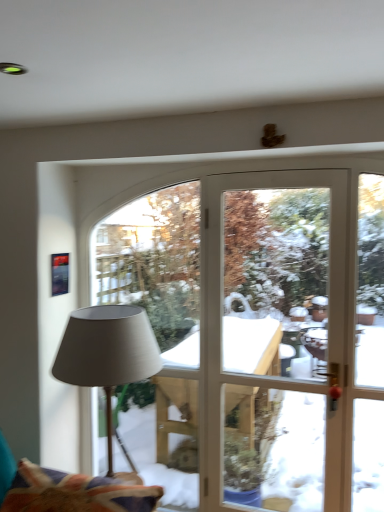
Question: From the image's perspective, is matte gray fabric lamp at left positioned above or below velvet fabric swivel chair at lower left?

Choices:
 (A) below
 (B) above

Answer: (B)

Question: In terms of height, does matte gray fabric lamp at left look taller or shorter compared to velvet fabric swivel chair at lower left?

Choices:
 (A) tall
 (B) short

Answer: (A)

Question: Would you say matte gray fabric lamp at left is to the left or to the right of velvet fabric swivel chair at lower left in the picture?

Choices:
 (A) left
 (B) right

Answer: (B)

Question: From a real-world perspective, relative to matte gray fabric lamp at left, is velvet fabric swivel chair at lower left vertically above or below?

Choices:
 (A) above
 (B) below

Answer: (B)

Question: Is velvet fabric swivel chair at lower left spatially inside matte gray fabric lamp at left, or outside of it?

Choices:
 (A) outside
 (B) inside

Answer: (A)

Question: Relative to matte gray fabric lamp at left, is velvet fabric swivel chair at lower left in front or behind?

Choices:
 (A) front
 (B) behind

Answer: (A)

Question: Visually, is velvet fabric swivel chair at lower left positioned to the left or to the right of matte gray fabric lamp at left?

Choices:
 (A) right
 (B) left

Answer: (B)